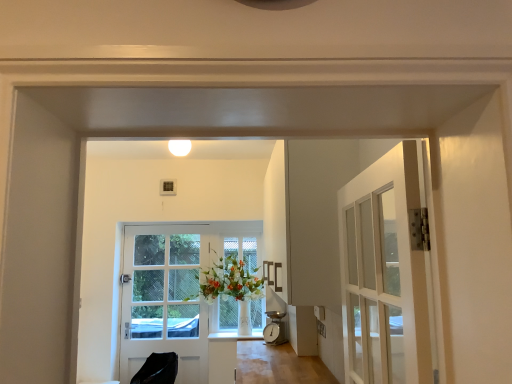
Question: Can you confirm if clear glass window at center is positioned to the left of white matte light fixture at upper center?

Choices:
 (A) no
 (B) yes

Answer: (A)

Question: Does clear glass window at center have a smaller size compared to white matte light fixture at upper center?

Choices:
 (A) yes
 (B) no

Answer: (B)

Question: Is clear glass window at center not near white matte light fixture at upper center?

Choices:
 (A) no
 (B) yes

Answer: (B)

Question: From a real-world perspective, is clear glass window at center positioned under white matte light fixture at upper center based on gravity?

Choices:
 (A) yes
 (B) no

Answer: (A)

Question: Is clear glass window at center taller than white matte light fixture at upper center?

Choices:
 (A) no
 (B) yes

Answer: (B)

Question: From a real-world perspective, is black leather chair at lower left above or below white matte light fixture at upper center?

Choices:
 (A) above
 (B) below

Answer: (B)

Question: In terms of height, does black leather chair at lower left look taller or shorter compared to white matte light fixture at upper center?

Choices:
 (A) tall
 (B) short

Answer: (A)

Question: Considering the positions of black leather chair at lower left and white matte light fixture at upper center in the image, is black leather chair at lower left wider or thinner than white matte light fixture at upper center?

Choices:
 (A) thin
 (B) wide

Answer: (B)

Question: From the image's perspective, is black leather chair at lower left positioned above or below white matte light fixture at upper center?

Choices:
 (A) above
 (B) below

Answer: (B)

Question: Which is correct: black leather chair at lower left is inside clear glass window at center, or outside of it?

Choices:
 (A) inside
 (B) outside

Answer: (B)

Question: From the image's perspective, is black leather chair at lower left above or below clear glass window at center?

Choices:
 (A) below
 (B) above

Answer: (A)

Question: Considering the positions of black leather chair at lower left and clear glass window at center in the image, is black leather chair at lower left bigger or smaller than clear glass window at center?

Choices:
 (A) small
 (B) big

Answer: (B)

Question: From a real-world perspective, is black leather chair at lower left above or below clear glass window at center?

Choices:
 (A) above
 (B) below

Answer: (B)

Question: From the image's perspective, is white glossy door at center located above or below white matte light fixture at upper center?

Choices:
 (A) below
 (B) above

Answer: (A)

Question: In the image, is white glossy door at center positioned in front of or behind white matte light fixture at upper center?

Choices:
 (A) front
 (B) behind

Answer: (B)